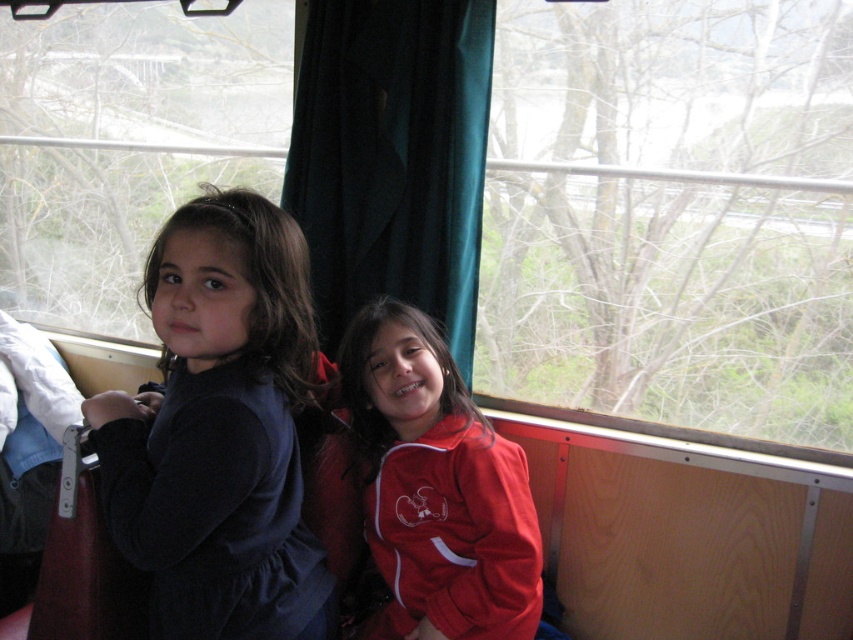
You are a passenger on a train and want to see the outside view clearly. You notice two transparent glass windows available. Which window, the transparent glass window at center or the transparent glass window at upper left, would allow you to see a wider view of the outside?

The transparent glass window at upper left has a greater width compared to the transparent glass window at center, so it would allow you to see a wider view of the outside.

You are sitting on a train and want to look outside through the transparent glass window at upper left. However, there is a red matte jacket at center in the way. Can you see the outside view through the window without moving the jacket?

The transparent glass window at upper left is above the red matte jacket at center, so you can still see the outside view through the window without moving the jacket because the window is positioned higher than the jacket.